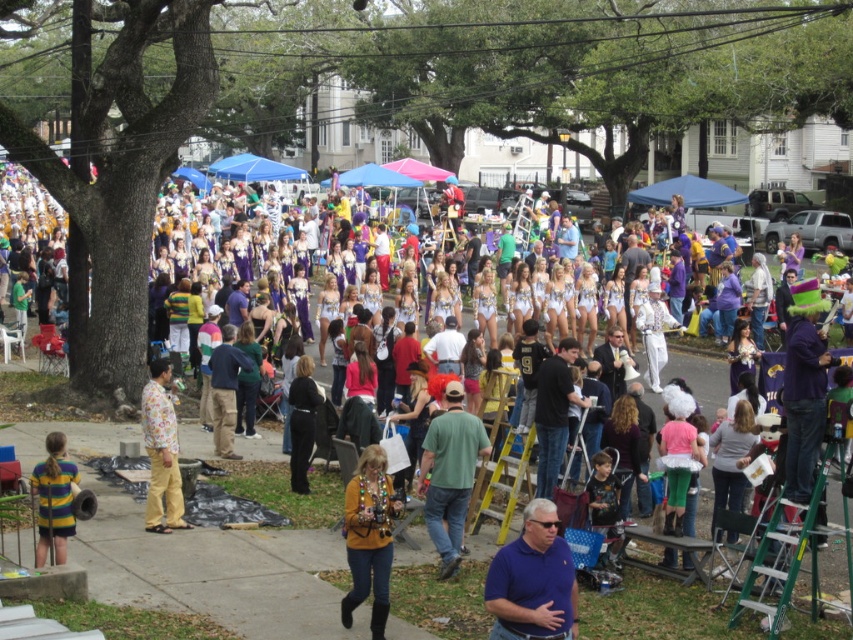
Question: Observing the image, what is the correct spatial positioning of green cotton shirt at center in reference to striped jersey at lower left?

Choices:
 (A) right
 (B) left

Answer: (A)

Question: Which of the following is the farthest from the observer?

Choices:
 (A) (299, 368)
 (B) (380, 572)

Answer: (A)

Question: Is blue shirt at lower center below striped jersey at lower left?

Choices:
 (A) yes
 (B) no

Answer: (A)

Question: Is green cotton shirt at center thinner than floral-patterned shirt at center?

Choices:
 (A) yes
 (B) no

Answer: (B)

Question: Which point is farther from the camera taking this photo?

Choices:
 (A) (439, 442)
 (B) (154, 460)

Answer: (B)

Question: Among these objects, which one is farthest from the camera?

Choices:
 (A) striped jersey at lower left
 (B) black leather jacket at center
 (C) yellow sweater at center
 (D) green cotton shirt at center

Answer: (B)